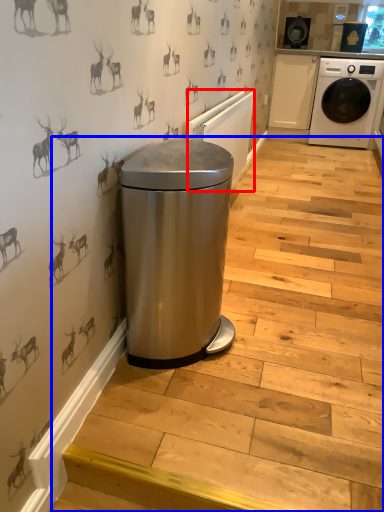
Question: Which of the following is the closest to the observer, radiator (highlighted by a red box) or stairwell (highlighted by a blue box)?

Choices:
 (A) radiator
 (B) stairwell

Answer: (B)